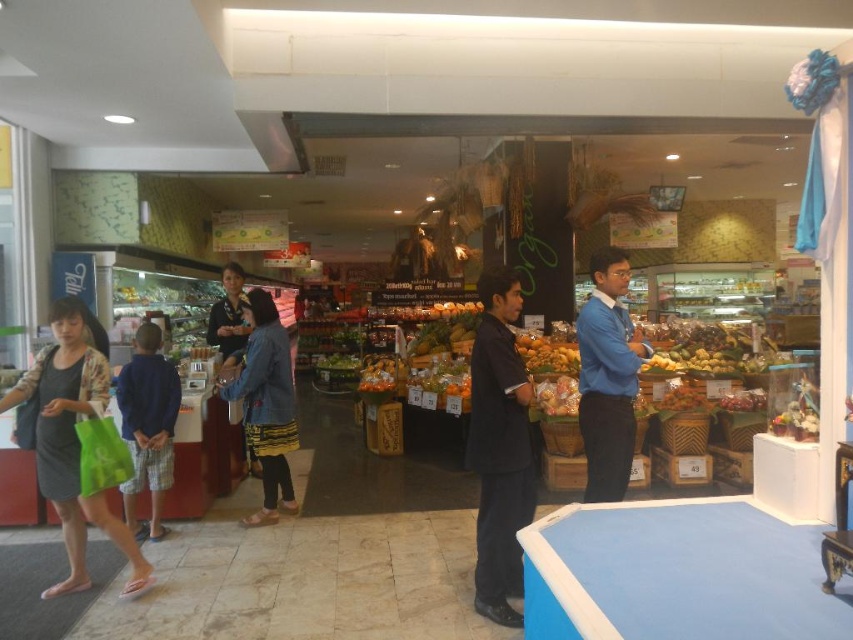
You are a store employee trying to decide which clothing item to place on a smaller hanger. You see the blue smooth shirt at center and the denim jacket at center. Which item would fit better on the smaller hanger?

The blue smooth shirt at center has a smaller size compared to the denim jacket at center, so it would fit better on the smaller hanger.

You are a store employee who needs to place a new item on the shelf. The shelf you are targeting has a width of 1 meter. You have two items to choose from, the matte green bag at lower left and the denim jacket at center. Which item would fit better on the shelf?

The matte green bag at lower left is wider than the denim jacket at center. Since the shelf is 1 meter wide, the matte green bag at lower left would fit better on the shelf.

You are standing in the grocery store and want to reach the point at coordinates (68,554). The store has a modern design with clean lines and bright lighting. Can you estimate how far you need to walk to reach that point?

The point at coordinates (68,554) is 3.84 meters away from you, so you need to walk approximately 3.84 meters to reach it.